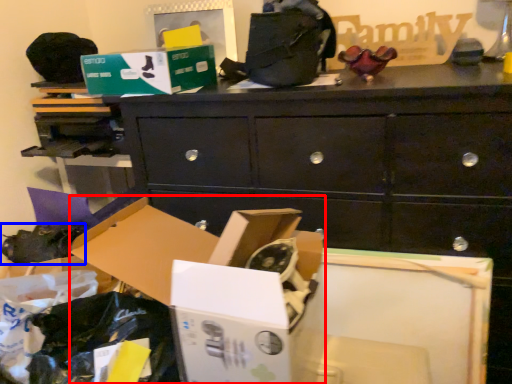
Question: Which point is further to the camera, storage box (highlighted by a red box) or shoe (highlighted by a blue box)?

Choices:
 (A) storage box
 (B) shoe

Answer: (B)